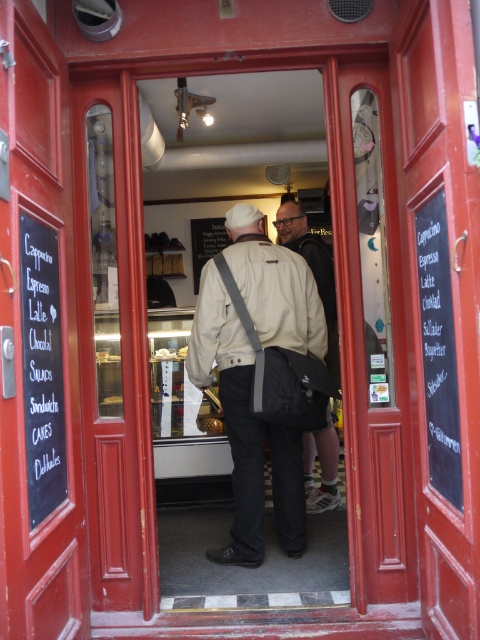
You are a customer entering the bakery and see two jackets hanging at the entrance. The beige fabric jacket at center and the matte beige jacket at center. Which one is taller?

The beige fabric jacket at center is much taller than the matte beige jacket at center.

You are a customer entering the cozy cafe through the open red wooden doors. You notice a beige fabric jacket at center. Where is the beige fabric jacket located in relation to the display case?

The beige fabric jacket at center is located at point [245,429], which is to the right of the display case.

From the picture: You are standing outside the red wooden doors of the cafe and want to reach the display case inside. The display case is located at the point marked by coordinates point (301,472). If you can move forward 9 feet, will you be able to reach the display case?

The point (301,472) is 9.84 feet from the viewer. Since you can move forward 9 feet, you will not reach the display case as the distance is slightly more than your movement capability.